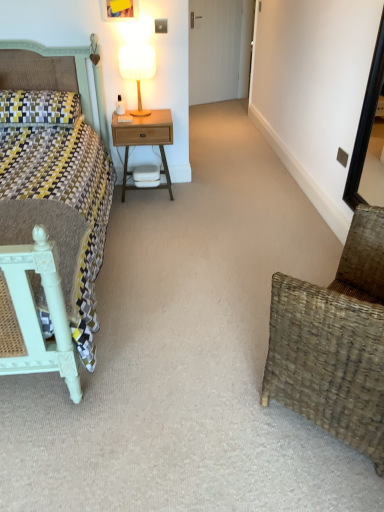
Image resolution: width=384 pixels, height=512 pixels. Identify the location of free space to the left of woven brown chair at lower right. (220, 395).